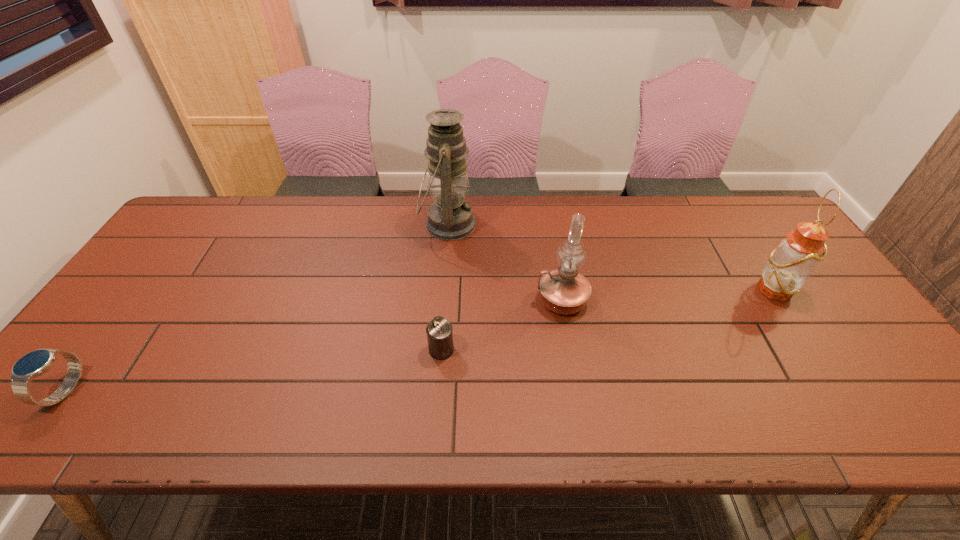
At what (x,y) coordinates should I click in order to perform the action: click on free space between the watch and the can. Please return your answer as a coordinate pair (x, y). The image size is (960, 540). Looking at the image, I should click on (253, 370).

Find the location of a particular element. Image resolution: width=960 pixels, height=540 pixels. unoccupied position between the leftmost oil lamp and the second oil lamp from left to right is located at coordinates (505, 262).

Choose which object is the fourth nearest neighbor to the second nearest object. Please provide its 2D coordinates. Your answer should be formatted as a tuple, i.e. [(x, y)], where the tuple contains the x and y coordinates of a point satisfying the conditions above.

[(789, 266)]

Where is `object identified as the second closest to the farthest object`? The image size is (960, 540). object identified as the second closest to the farthest object is located at coordinates [x=439, y=331].

Image resolution: width=960 pixels, height=540 pixels. I want to click on oil lamp that is the second closest to the fourth object from left to right, so click(789, 266).

At what (x,y) coordinates should I click in order to perform the action: click on oil lamp that is the closest to the second nearest object. Please return your answer as a coordinate pair (x, y). This screenshot has height=540, width=960. Looking at the image, I should click on (564, 291).

Find the location of `free point that satisfies the following two spatial constraints: 1. on the back side of the nearest object; 2. on the left side of the can`. free point that satisfies the following two spatial constraints: 1. on the back side of the nearest object; 2. on the left side of the can is located at coordinates (96, 349).